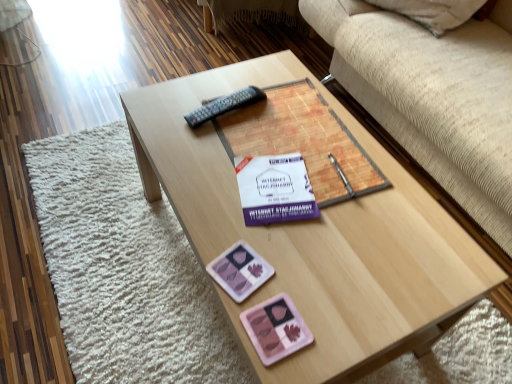
Locate an element on the screen. Image resolution: width=512 pixels, height=384 pixels. vacant area to the right of black plastic remote at center is located at coordinates (287, 120).